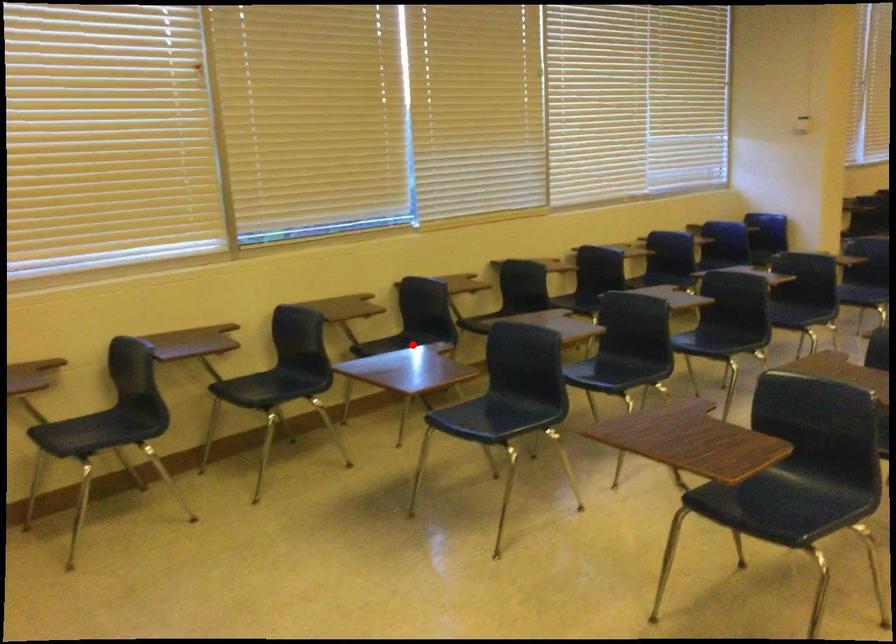
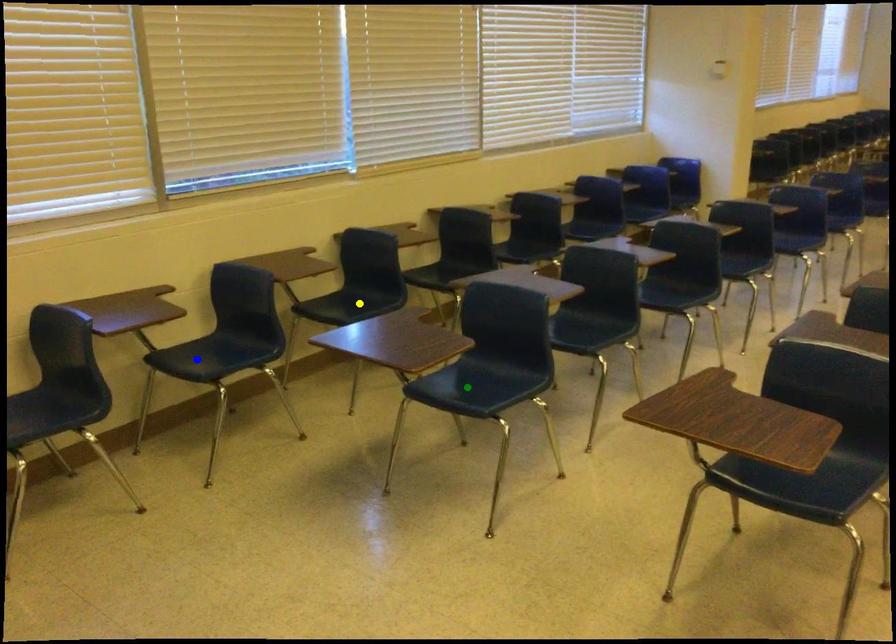
Question: I am providing you with two images of the same scene from different viewpoints. A red point is marked on the first image. You are given multiple points on the second image. In image 2, which mark is for the same physical point as the one in image 1?

Choices:
 (A) blue point
 (B) green point
 (C) yellow point

Answer: (C)